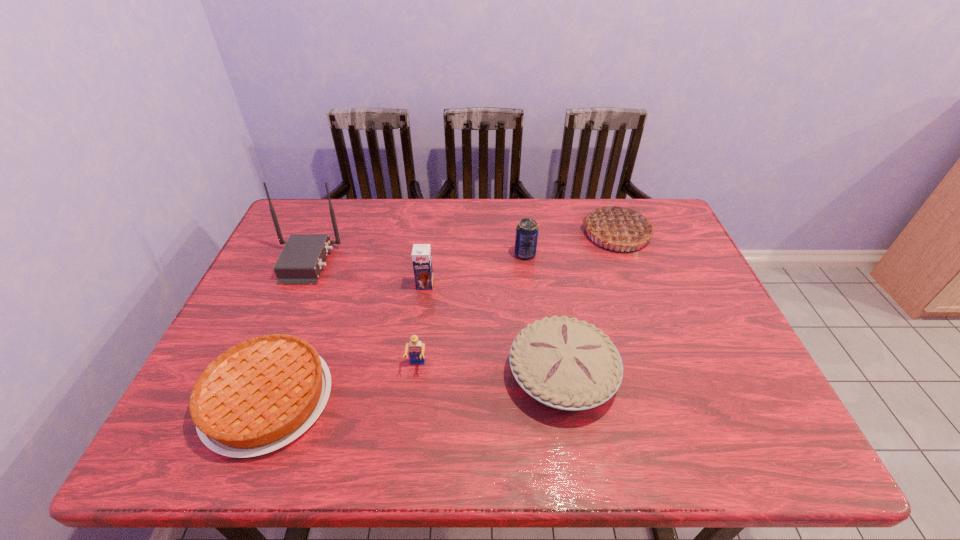
Locate an element on the screen. object that is at the near left corner is located at coordinates (258, 396).

You are a GUI agent. You are given a task and a screenshot of the screen. Output one action in this format:
    pyautogui.click(x=<x>, y=<y>)
    Task: Click on the object present at the far right corner
    This screenshot has width=960, height=540.
    Given the screenshot: What is the action you would take?
    pyautogui.click(x=619, y=226)

In order to click on free space at the far edge in this screenshot , I will do `click(346, 214)`.

The height and width of the screenshot is (540, 960). Find the location of `free space at the near edge`. free space at the near edge is located at coordinates (646, 425).

Where is `vacant region at the left edge of the desktop`? This screenshot has width=960, height=540. vacant region at the left edge of the desktop is located at coordinates (284, 316).

Image resolution: width=960 pixels, height=540 pixels. In the image, there is a desktop. Identify the location of vacant space at the right edge. (667, 320).

In the image, there is a desktop. Where is `vacant space at the far right corner`? vacant space at the far right corner is located at coordinates (647, 217).

Find the location of `vacant region between the soda and the shortest object`. vacant region between the soda and the shortest object is located at coordinates click(x=396, y=327).

Where is `unoccupied area between the router and the third tallest object`? unoccupied area between the router and the third tallest object is located at coordinates (366, 273).

Where is `free space between the soda and the Lego`? This screenshot has height=540, width=960. free space between the soda and the Lego is located at coordinates (471, 310).